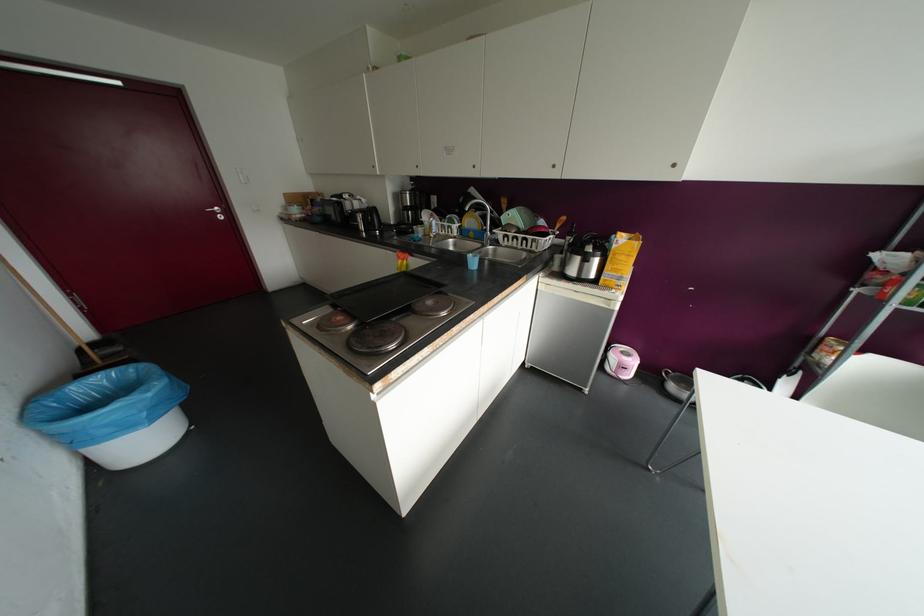
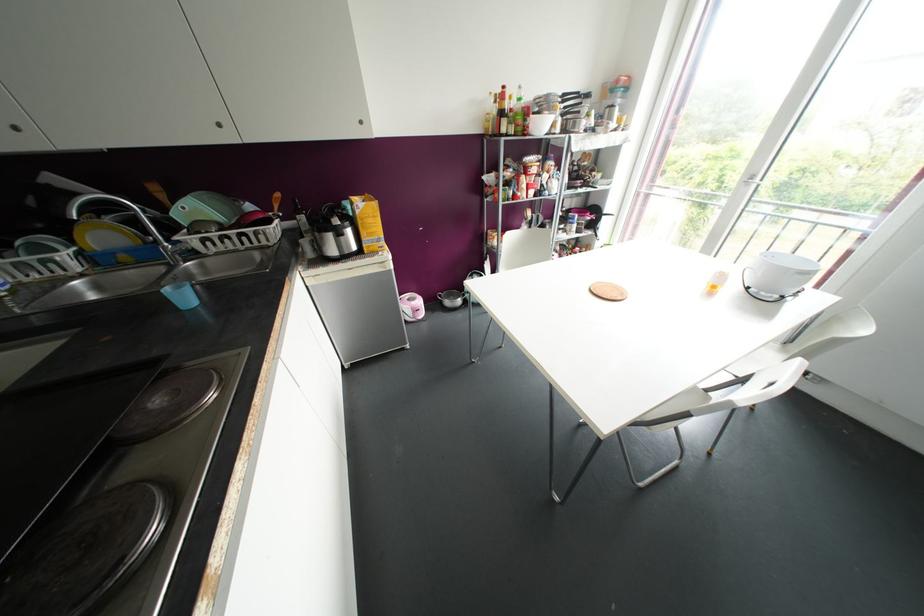
Where in the second image is the point corresponding to point (673, 164) from the first image?

(360, 122)